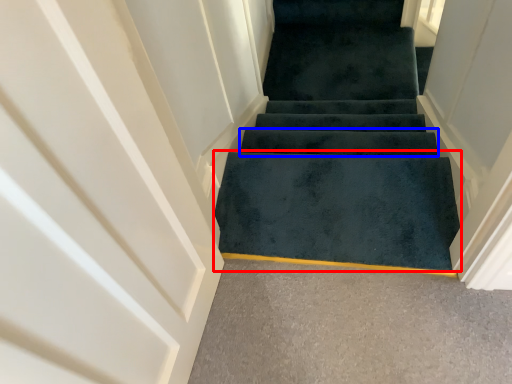
Question: Among these objects, which one is farthest to the camera, doormat (highlighted by a red box) or stair (highlighted by a blue box)?

Choices:
 (A) doormat
 (B) stair

Answer: (B)